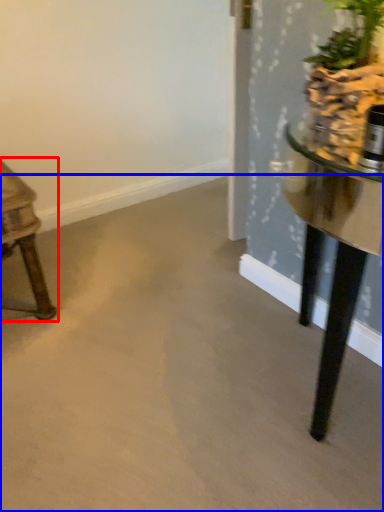
Question: Which of the following is the closest to the observer, table (highlighted by a red box) or concrete (highlighted by a blue box)?

Choices:
 (A) table
 (B) concrete

Answer: (B)